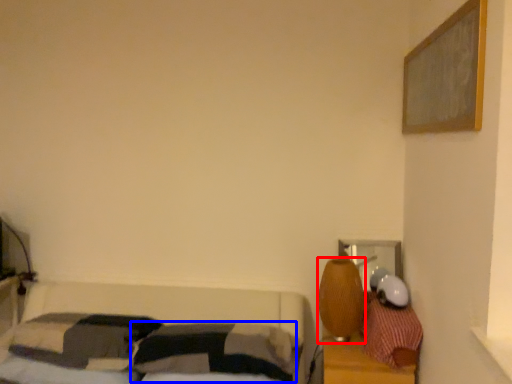
Question: Which point is further to the camera, table lamp (highlighted by a red box) or pillow (highlighted by a blue box)?

Choices:
 (A) table lamp
 (B) pillow

Answer: (A)